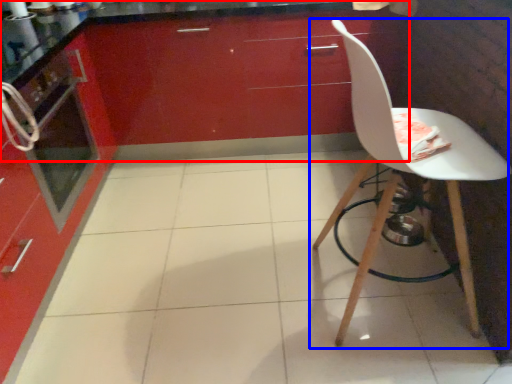
Question: Which object appears farthest to the camera in this image, cabinetry (highlighted by a red box) or chair (highlighted by a blue box)?

Choices:
 (A) cabinetry
 (B) chair

Answer: (A)